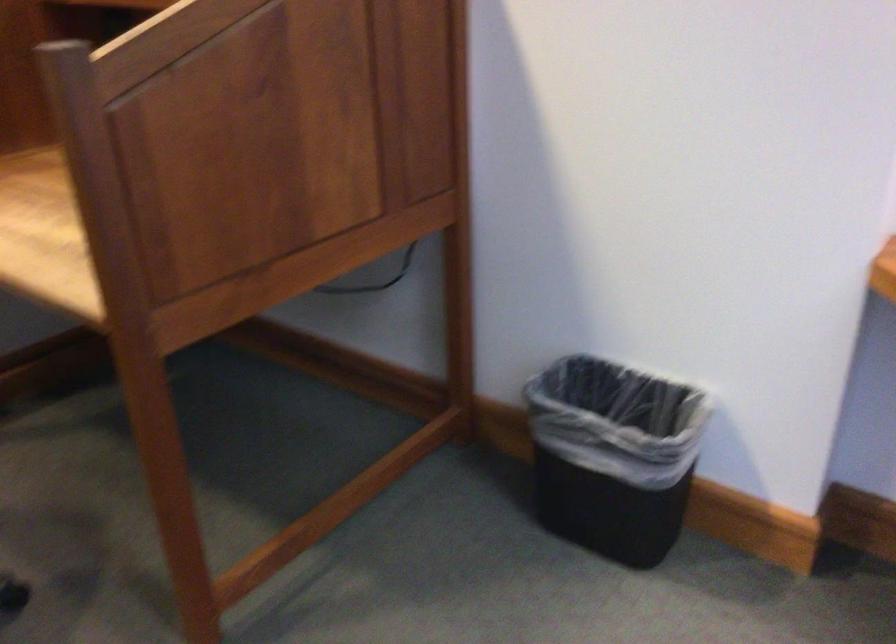
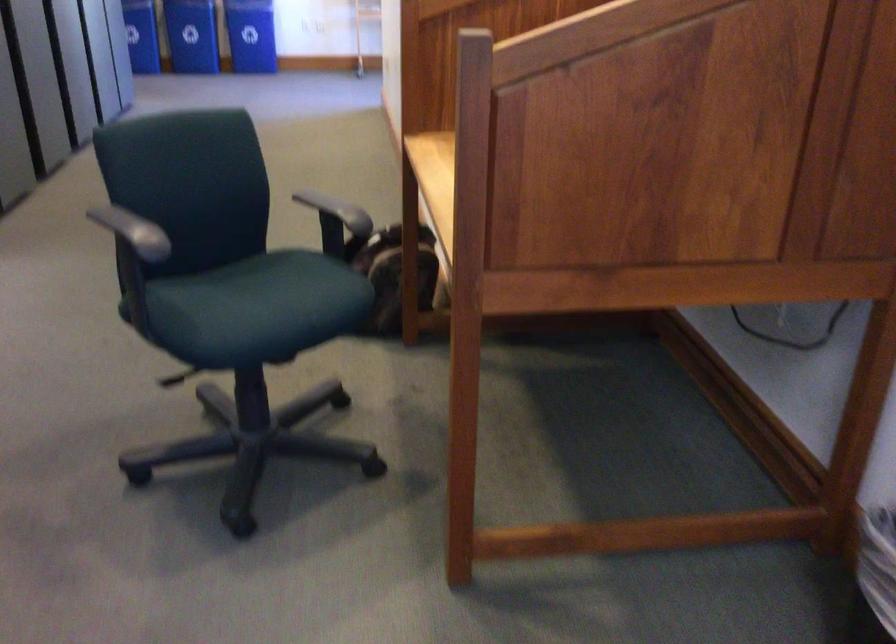
Question: How did the camera likely rotate?

Choices:
 (A) Left
 (B) Right
 (C) Up
 (D) Down

Answer: (A)